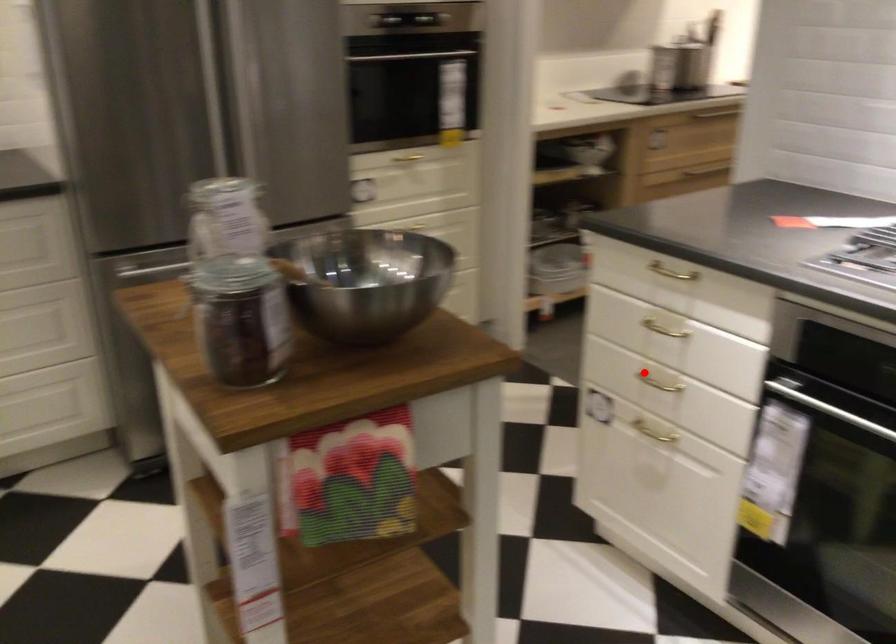
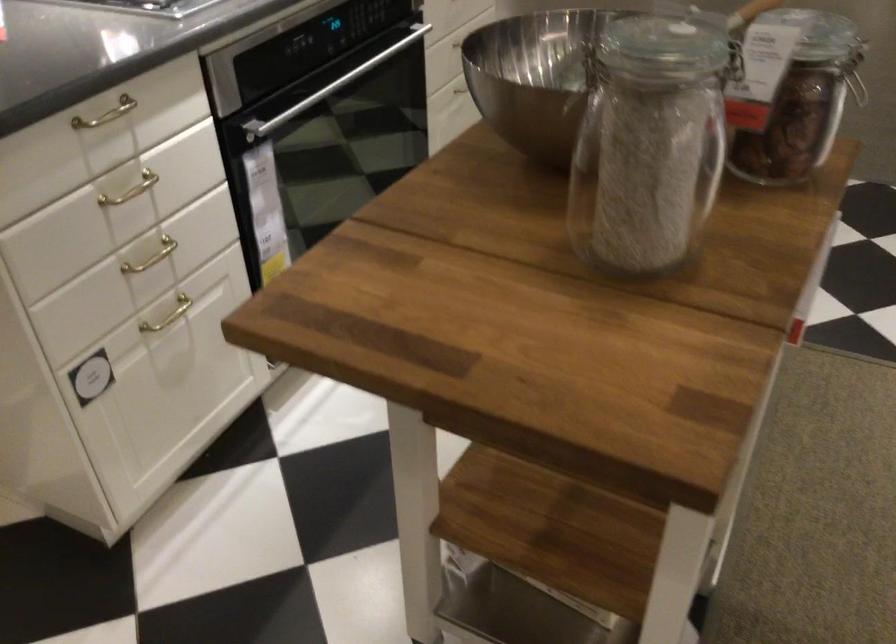
Where in the second image is the point corresponding to the highlighted location from the first image?

(151, 257)